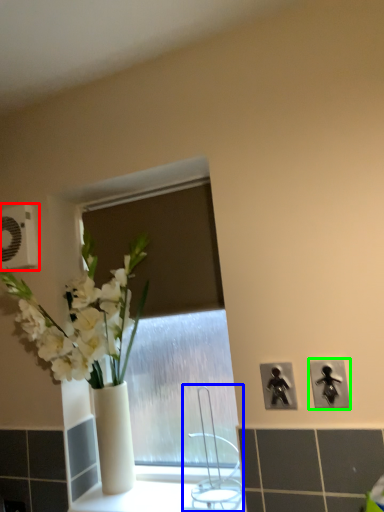
Question: Which object is the farthest from electric outlet (highlighted by a red box)? Choose among these: faucet (highlighted by a blue box) or electric outlet (highlighted by a green box).

Choices:
 (A) faucet
 (B) electric outlet

Answer: (B)